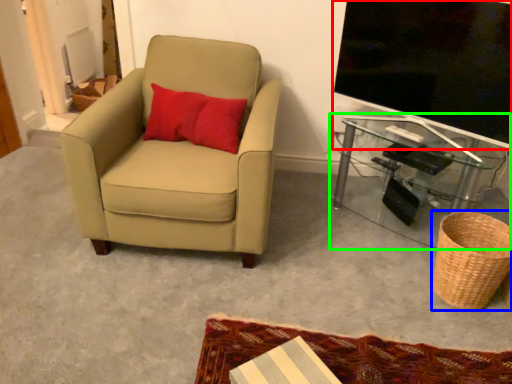
Question: Estimate the real-world distances between objects in this image. Which object is farther from television (highlighted by a red box), basket (highlighted by a blue box) or table (highlighted by a green box)?

Choices:
 (A) basket
 (B) table

Answer: (A)